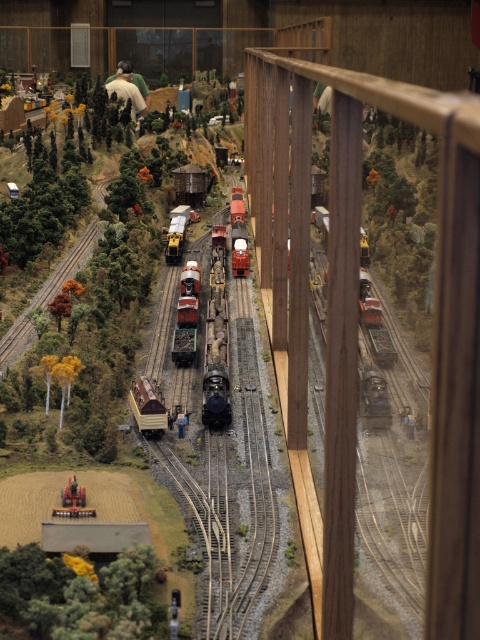
Question: Which point is farther from the camera taking this photo?

Choices:
 (A) click(x=173, y=336)
 (B) click(x=148, y=412)
 (C) click(x=240, y=273)

Answer: (C)

Question: Observing the image, what is the correct spatial positioning of metallic red train car at center in reference to metallic silver train at center?

Choices:
 (A) right
 (B) left

Answer: (A)

Question: Does matte brown wooden train car at center appear on the right side of metallic silver train at center?

Choices:
 (A) yes
 (B) no

Answer: (A)

Question: Where is shiny silver train at center located in relation to metallic silver train at center in the image?

Choices:
 (A) below
 (B) above

Answer: (A)

Question: Which of the following is the farthest from the observer?

Choices:
 (A) matte brown wooden train car at center
 (B) shiny silver train at center

Answer: (B)

Question: Estimate the real-world distances between objects in this image. Which object is farther from the metallic silver train at center?

Choices:
 (A) matte brown wooden train car at center
 (B) metallic red train car at center
 (C) shiny silver train at center
 (D) matte red train at center

Answer: (A)